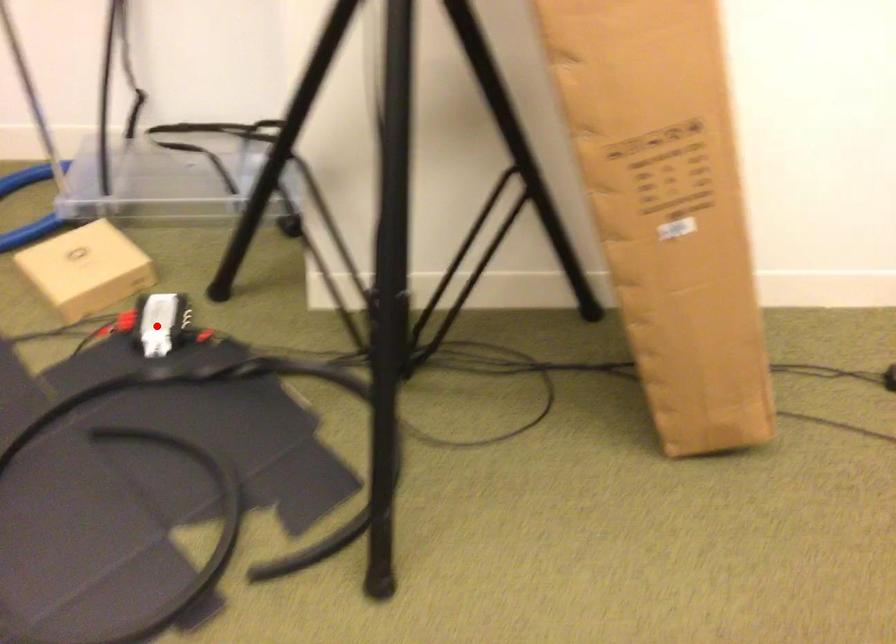
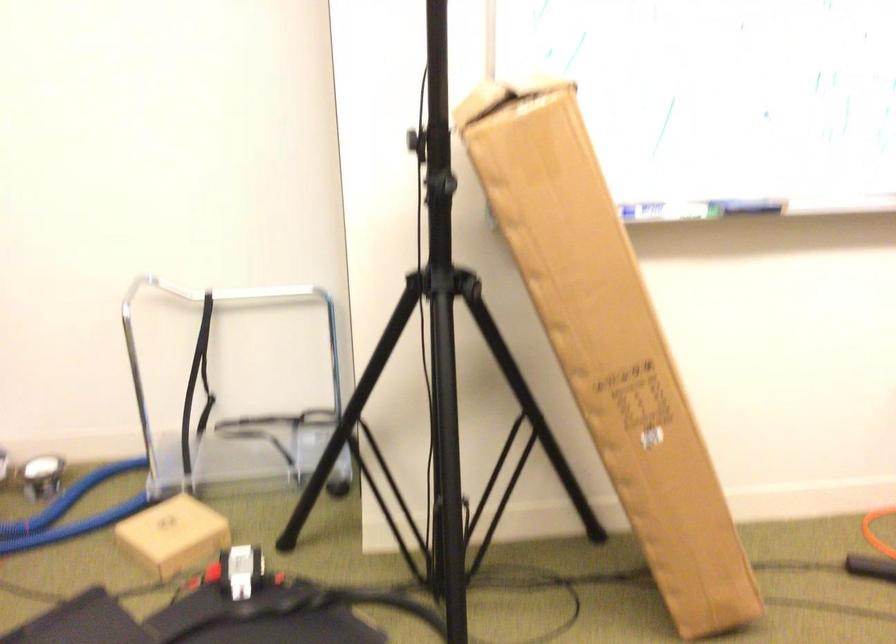
Question: I am providing you with two images of the same scene from different viewpoints. In image1, a red point is highlighted. Considering the same 3D point in image2, which of the following is correct?

Choices:
 (A) It is closer
 (B) It is farther

Answer: (B)